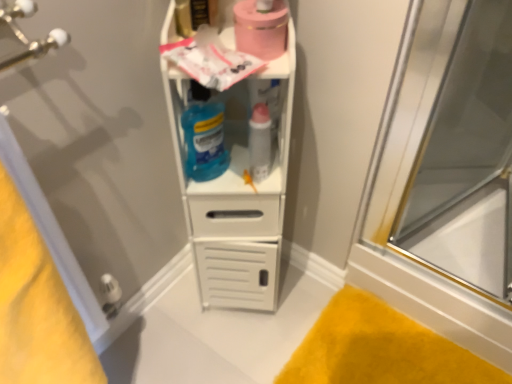
At what (x,y) coordinates should I click in order to perform the action: click on vacant space to the right of white plastic shelf at center. Please return your answer as a coordinate pair (x, y). Image resolution: width=512 pixels, height=384 pixels. Looking at the image, I should click on coord(302,291).